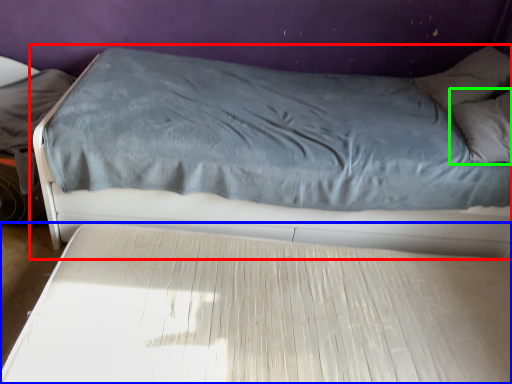
Question: Based on their relative distances, which object is nearer to bed (highlighted by a red box)? Choose from bed (highlighted by a blue box) and pillow (highlighted by a green box).

Choices:
 (A) bed
 (B) pillow

Answer: (A)